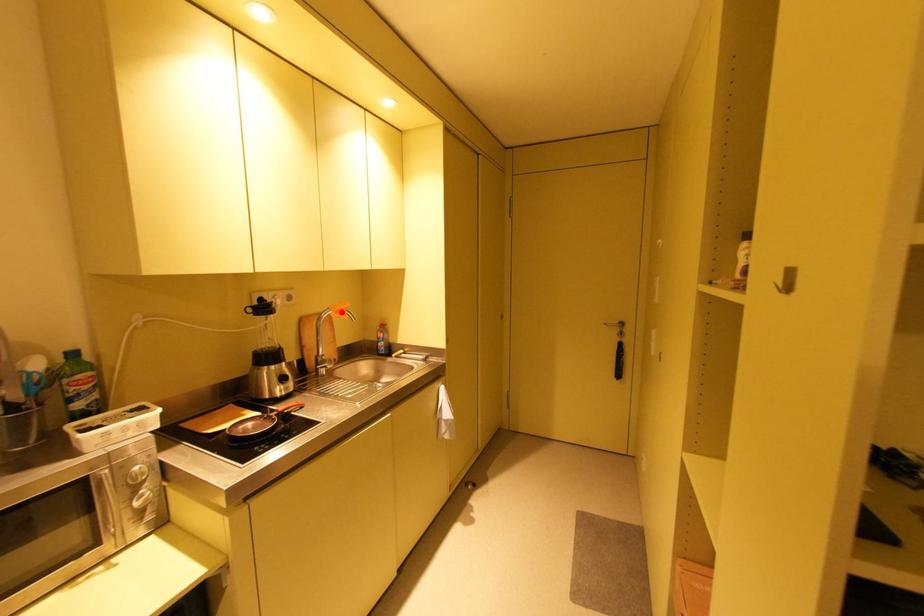
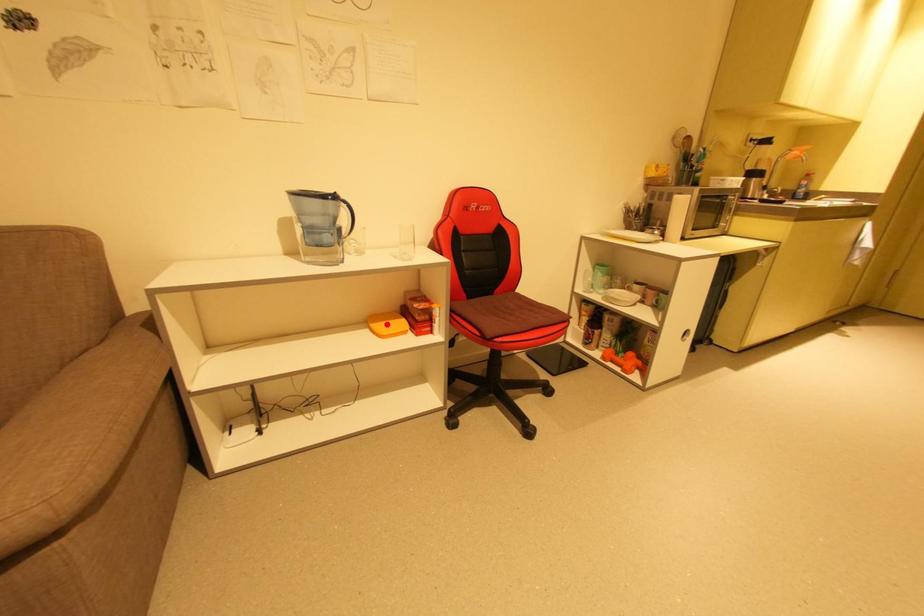
I am providing you with two images of the same scene from different viewpoints. A red point is marked on the first image and another point is marked on the second image. Does the point marked in image1 correspond to the same location as the one in image2?

No